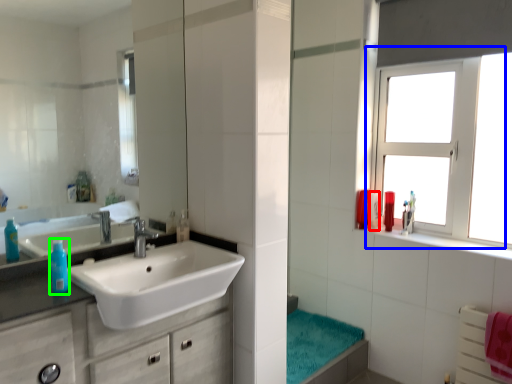
Question: Based on their relative distances, which object is farther from mouthwash (highlighted by a red box)? Choose from window (highlighted by a blue box) and turquoise (highlighted by a green box).

Choices:
 (A) window
 (B) turquoise

Answer: (B)